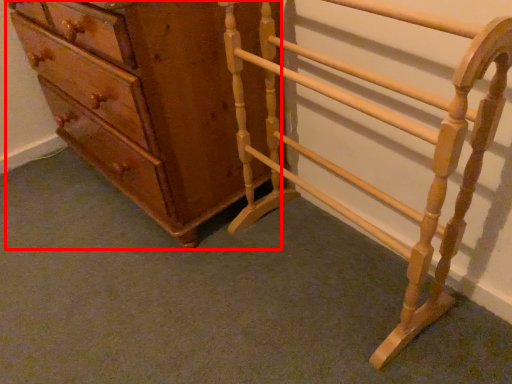
Question: From the image, what is the correct spatial relationship of chest of drawers (annotated by the red box) in relation to furniture?

Choices:
 (A) left
 (B) right

Answer: (A)